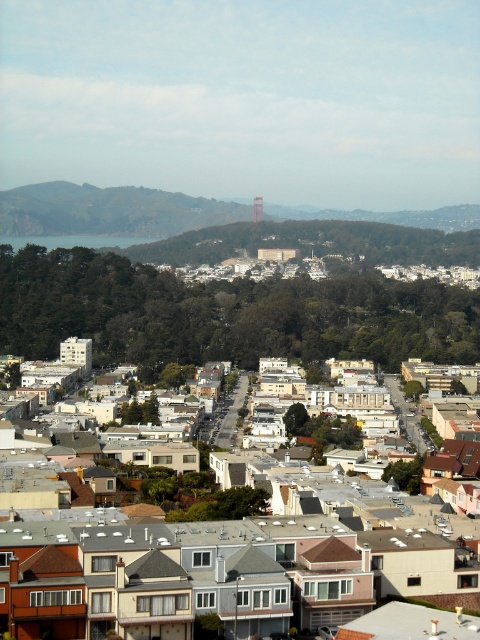
You are a delivery drone with a maximum flight range of 130 meters. You need to deliver a package from the starting point to the white matte houses at center. Can you complete the delivery without needing to recharge?

The distance between the starting point and the white matte houses at center is 134.04 meters, which exceeds the drone s 130 meter range. Therefore, the drone cannot complete the delivery without recharging.

You are a drone operator trying to capture aerial footage of the urban area. You need to position your drone to focus on the white matte houses at center. According to the coordinates provided, what is the exact 2D location you should aim for?

The exact 2D location for the white matte houses at center is point [183,577].

You are a city planner analyzing the urban layout. Based on the scene, which structure occupies more horizontal space in the image between the white matte houses at center and the orange metallic bridge at center?

The white matte houses at center might be wider than orange metallic bridge at center, so they likely occupy more horizontal space in the image.